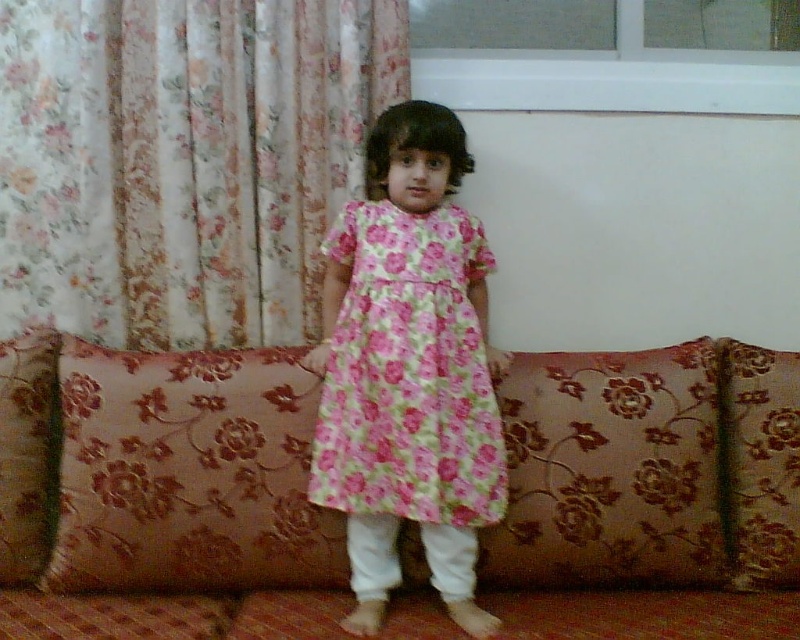
Question: Which object is closer to the camera taking this photo?

Choices:
 (A) floral fabric curtain at upper left
 (B) floral fabric pillow at left
 (C) brown floral cushion at center
 (D) floral fabric pillow at center

Answer: (B)

Question: Which object appears closest to the camera in this image?

Choices:
 (A) pink floral fabric couch at center
 (B) floral fabric pillow at left
 (C) floral fabric curtain at upper left

Answer: (A)

Question: Does floral cotton dress at center appear on the right side of floral fabric pillow at left?

Choices:
 (A) yes
 (B) no

Answer: (A)

Question: Which point appears farthest from the camera in this image?

Choices:
 (A) (38, 362)
 (B) (436, 224)

Answer: (A)

Question: In this image, where is pink floral fabric couch at center located relative to floral cotton dress at center?

Choices:
 (A) right
 (B) left

Answer: (B)

Question: Is pink floral fabric couch at center in front of floral fabric curtain at upper left?

Choices:
 (A) yes
 (B) no

Answer: (A)